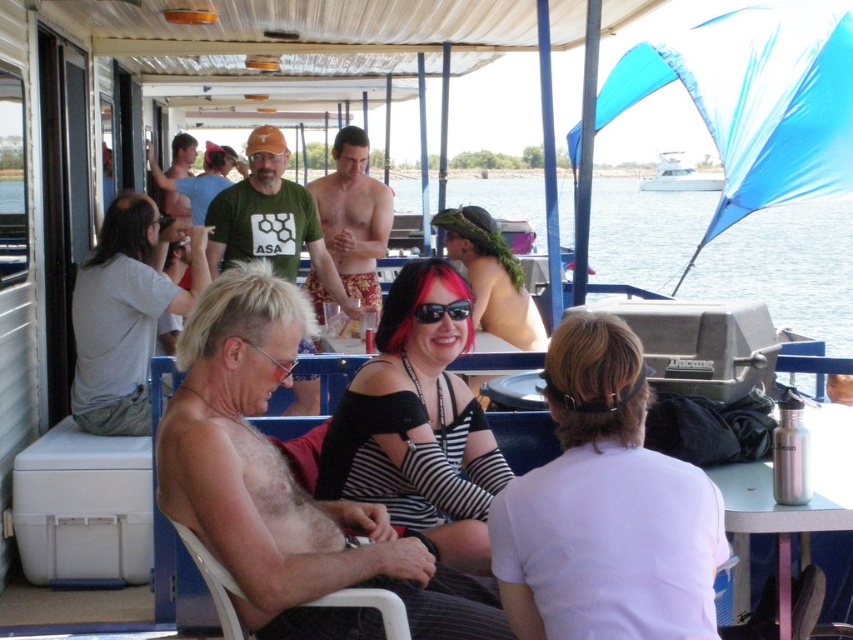
Does white matte shirt at center lie in front of white cotton shirt at left?

Yes, it is.

Is white matte shirt at center smaller than white cotton shirt at left?

Correct, white matte shirt at center occupies less space than white cotton shirt at left.

This screenshot has width=853, height=640. Identify the location of white matte shirt at center. (605, 508).

Does point (341, 228) come closer to viewer compared to point (679, 166)?

Yes, it is.

Is yellow patterned shorts at center shorter than white glossy boat at upper center?

Incorrect, yellow patterned shorts at center's height does not fall short of white glossy boat at upper center's.

Between point (339, 257) and point (680, 180), which one is positioned behind?

The point (680, 180) is behind.

Find the location of a particular element. Image resolution: width=853 pixels, height=640 pixels. yellow patterned shorts at center is located at coordinates pyautogui.click(x=352, y=216).

Does black striped shirt at center appear over white cotton shirt at left?

Incorrect, black striped shirt at center is not positioned above white cotton shirt at left.

Which is more to the right, black striped shirt at center or white cotton shirt at left?

black striped shirt at center

Which is behind, point (398, 308) or point (107, 234)?

Point (107, 234)

The width and height of the screenshot is (853, 640). I want to click on black striped shirt at center, so click(418, 422).